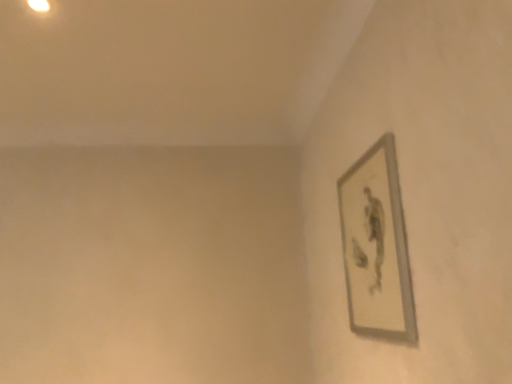
What do you see at coordinates (376, 246) in the screenshot?
I see `silver metallic picture frame at upper right` at bounding box center [376, 246].

What are the coordinates of `silver metallic picture frame at upper right` in the screenshot? It's located at pos(376,246).

Where is `silver metallic picture frame at upper right`? silver metallic picture frame at upper right is located at coordinates (376, 246).